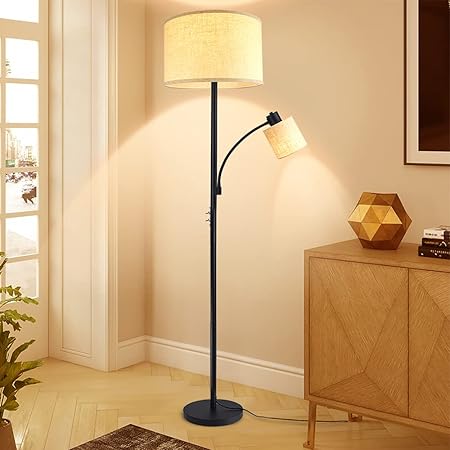
The height and width of the screenshot is (450, 450). I want to click on door, so click(30, 316).